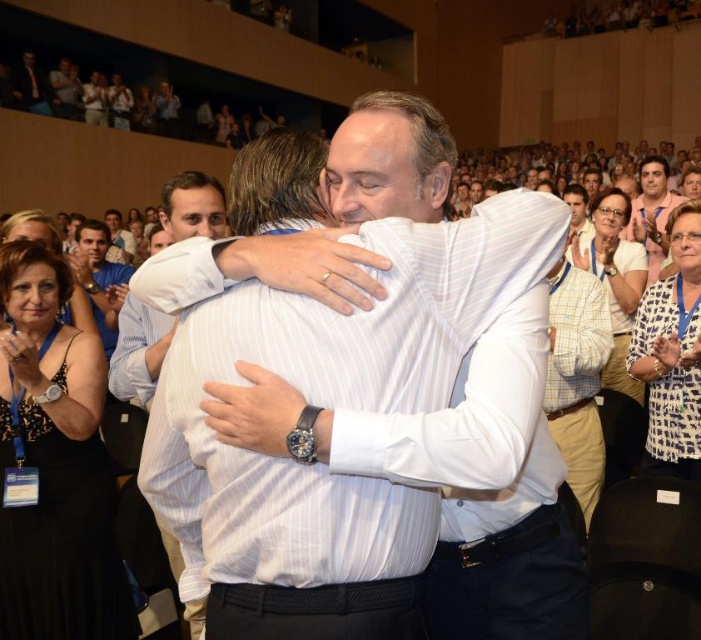
Question: Does black dotted dress at lower left appear on the right side of dark blue shirt at upper left?

Choices:
 (A) no
 (B) yes

Answer: (B)

Question: Which point is closer to the camera taking this photo?

Choices:
 (A) (109, 116)
 (B) (644, 332)

Answer: (B)

Question: Can you confirm if white striped shirt at center is positioned to the right of matte black phone at upper left?

Choices:
 (A) no
 (B) yes

Answer: (B)

Question: Which of the following is the farthest from the observer?

Choices:
 (A) 62,74
 (B) 46,308

Answer: (A)

Question: Which object appears closest to the camera in this image?

Choices:
 (A) black dotted dress at lower left
 (B) matte black phone at upper center

Answer: (A)

Question: Is matte white shirt at upper center further to camera compared to matte black shirt at upper left?

Choices:
 (A) yes
 (B) no

Answer: (B)